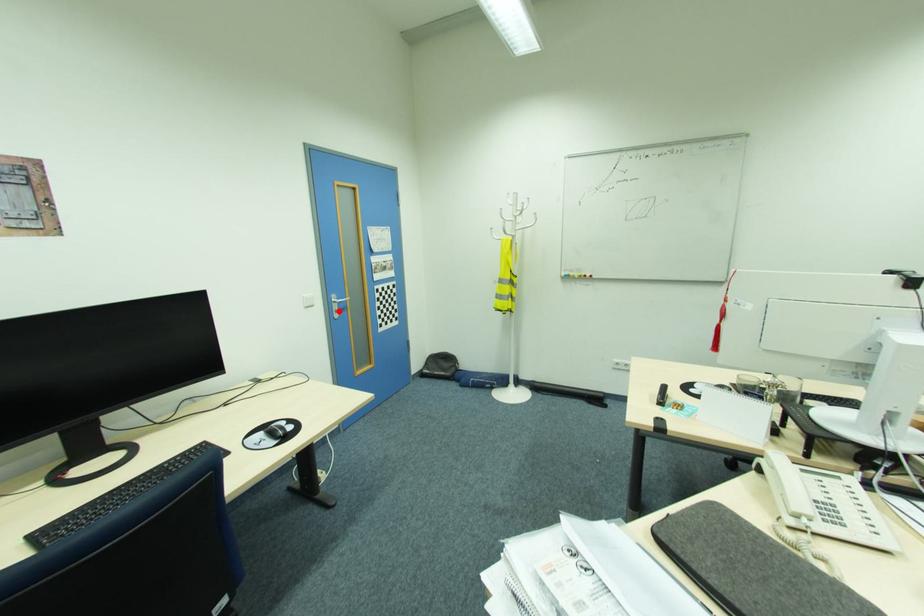
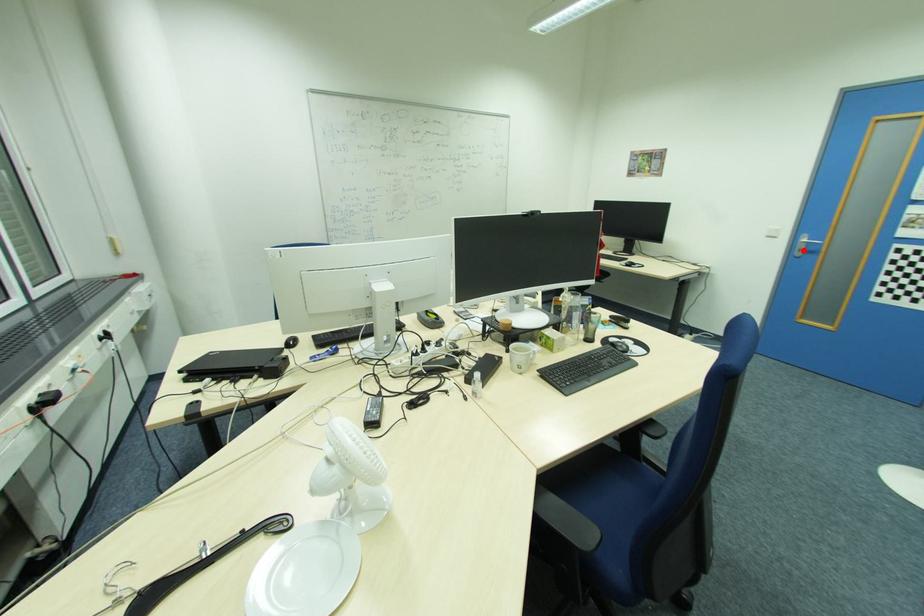
I am providing you with two images of the same scene from different viewpoints. A red point is marked on the first image and another point is marked on the second image. Does the point marked in image1 correspond to the same location as the one in image2?

Yes